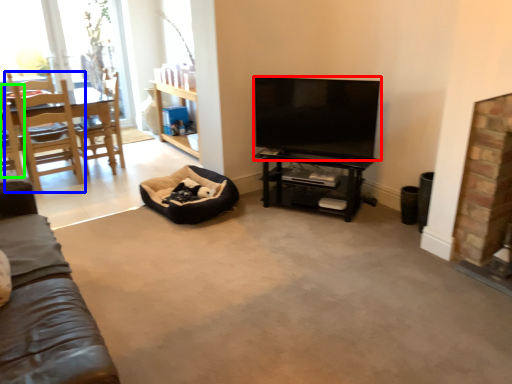
Question: Based on their relative distances, which object is farther from television (highlighted by a red box)? Choose from chair (highlighted by a blue box) and chair (highlighted by a green box).

Choices:
 (A) chair
 (B) chair

Answer: (B)